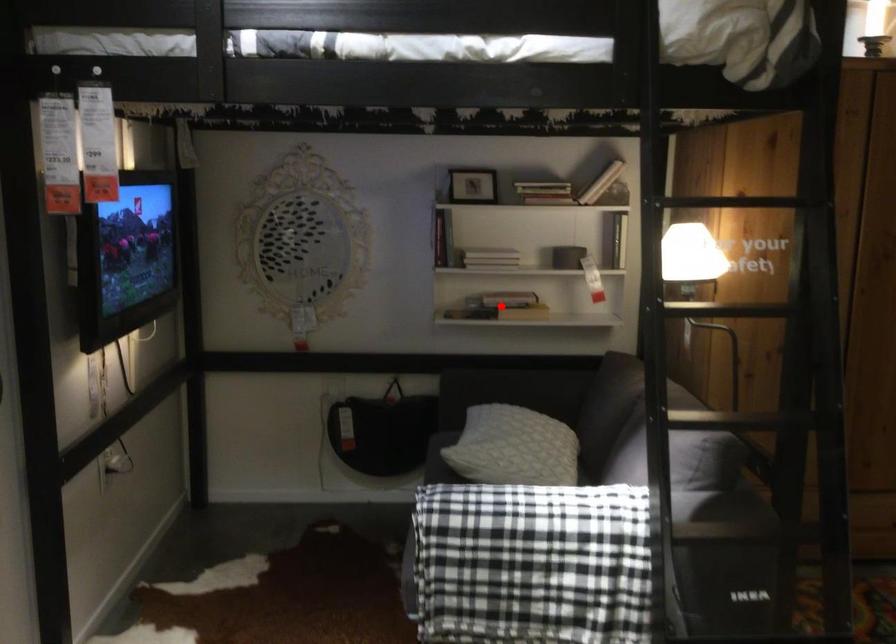
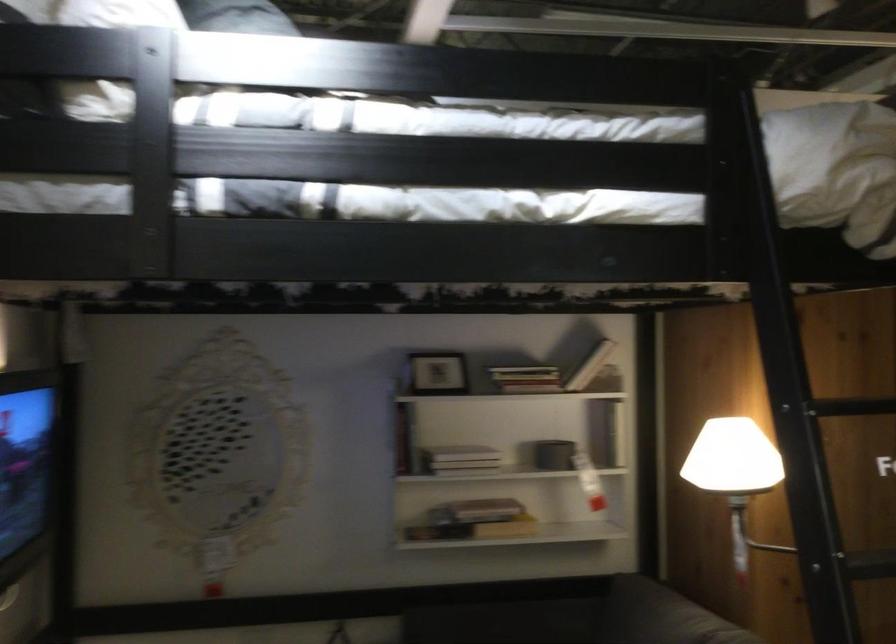
Question: A red point is marked in image1. In image2, is the corresponding 3D point closer to the camera or farther? Reply with the corresponding letter.

Choices:
 (A) The corresponding 3D point is closer.
 (B) The corresponding 3D point is farther.

Answer: (A)